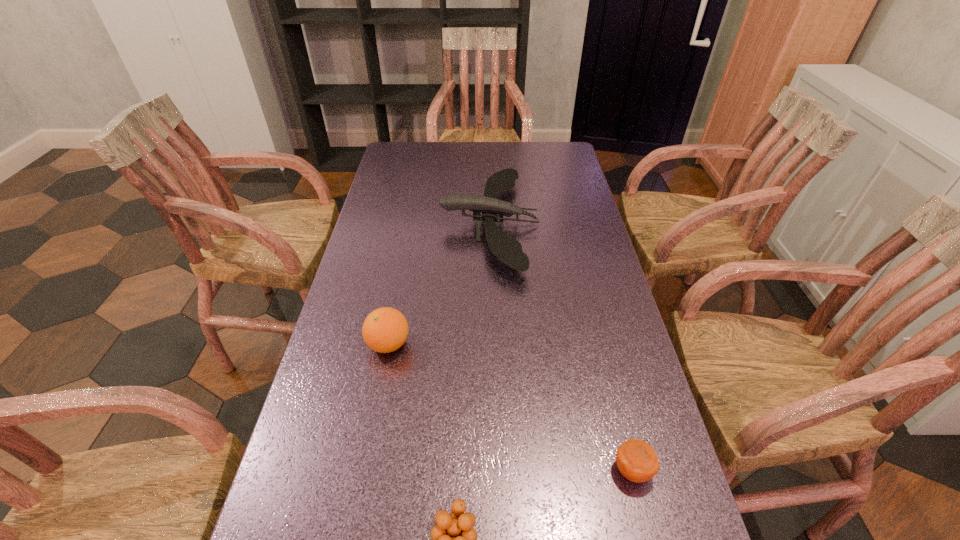
In order to click on the farthest object in this screenshot , I will do `click(507, 249)`.

The image size is (960, 540). Find the location of `the tallest orange fruit`. the tallest orange fruit is located at coordinates (384, 330).

The image size is (960, 540). Find the location of `the leftmost orange fruit`. the leftmost orange fruit is located at coordinates (384, 330).

At what (x,y) coordinates should I click in order to perform the action: click on the second nearest object. Please return your answer as a coordinate pair (x, y). The height and width of the screenshot is (540, 960). Looking at the image, I should click on (637, 461).

Where is `the second shortest object`? the second shortest object is located at coordinates (637, 461).

This screenshot has width=960, height=540. I want to click on free spot located 0.110m at the head of the drone, so click(x=406, y=224).

Identify the location of vacant space located at the head of the drone. (397, 224).

At what (x,y) coordinates should I click in order to perform the action: click on vacant space located at the head of the drone. Please return your answer as a coordinate pair (x, y). Looking at the image, I should click on (375, 224).

Where is `vacant space positioned on the front of the leftmost orange fruit`? The image size is (960, 540). vacant space positioned on the front of the leftmost orange fruit is located at coordinates (356, 515).

Where is `vacant space situated on the back of the second shortest object`? The image size is (960, 540). vacant space situated on the back of the second shortest object is located at coordinates (605, 363).